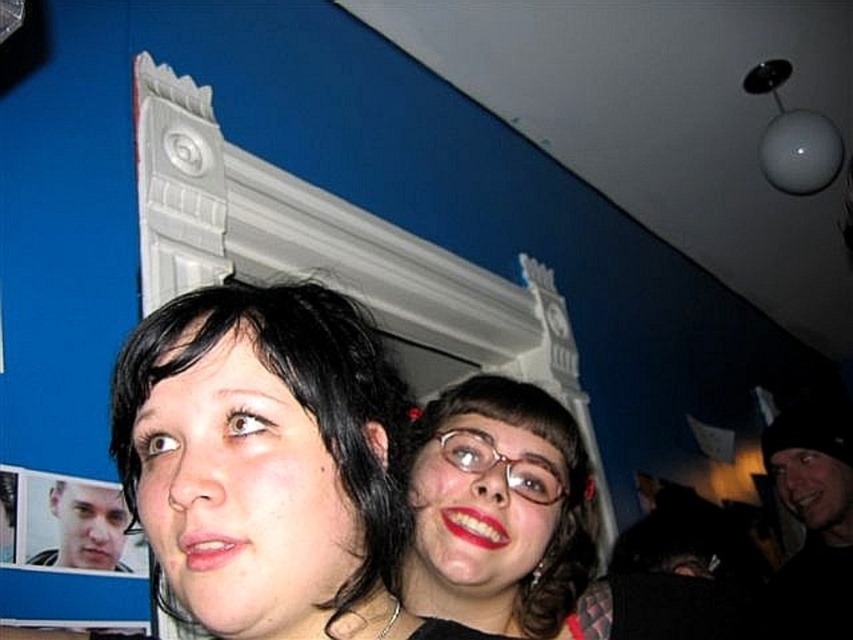
You are a photographer trying to position two subjects in a portrait. You see the smooth skin face at center and the smooth skin face at lower left. Which face should you adjust to ensure both are centered in the frame?

The smooth skin face at lower left should be moved to the right to align with the smooth skin face at center, as the smooth skin face at center is already positioned to the right of the smooth skin face at lower left.

You are a photographer setting up a portrait session. You need to ensure that both the smooth skin face at center and the smooth skin face at lower left are visible in the frame. Based on their positions, which face should you focus on first to ensure proper framing?

The smooth skin face at center is above the smooth skin face at lower left, so you should focus on the smooth skin face at center first to ensure proper framing as it is positioned higher in the frame.